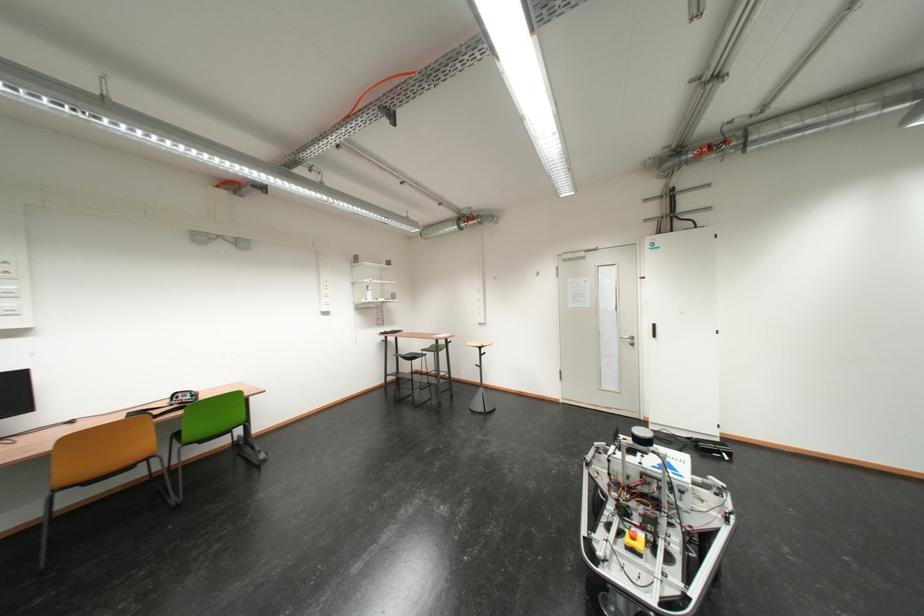
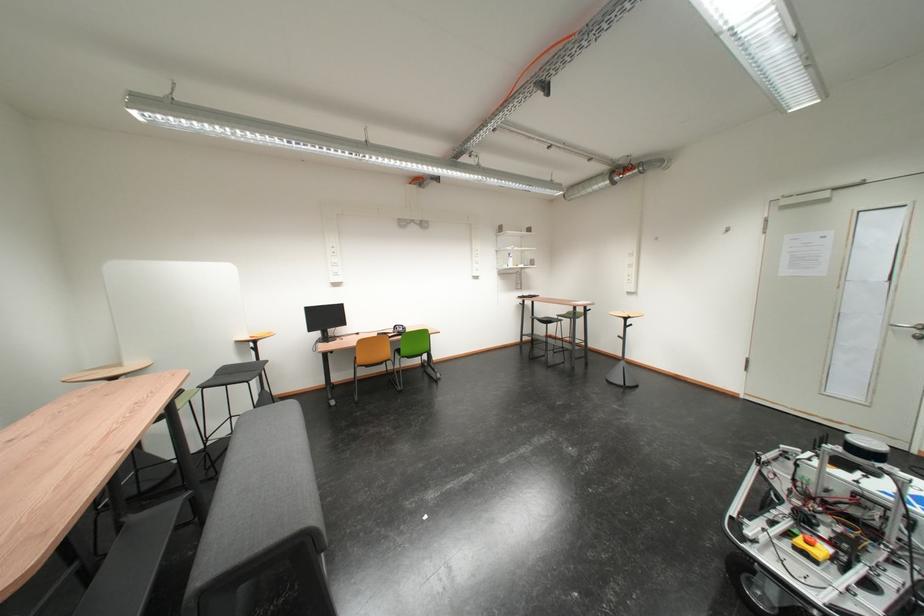
Where in the second image is the point corresponding to point 645,541 from the first image?

(820, 545)